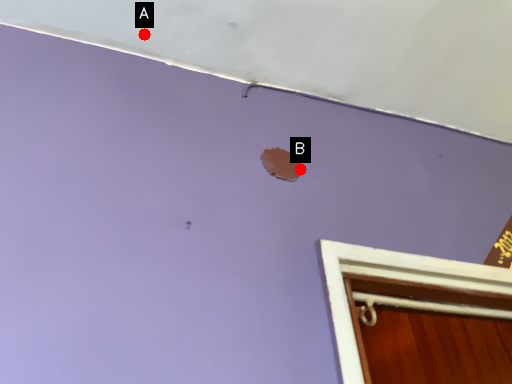
Question: Two points are circled on the image, labeled by A and B beside each circle. Which point is farther from the camera taking this photo?

Choices:
 (A) A is further
 (B) B is further

Answer: (A)